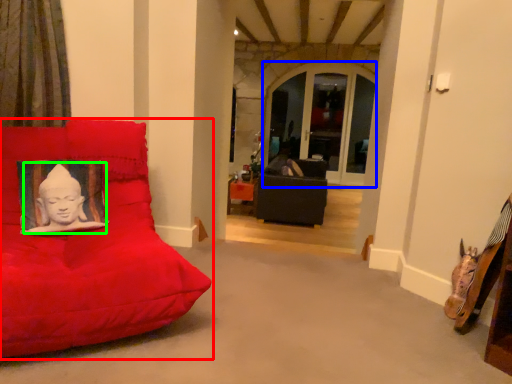
Question: Which object is positioned closest to furniture (highlighted by a red box)? Select from window (highlighted by a blue box) and person (highlighted by a green box).

Choices:
 (A) window
 (B) person

Answer: (B)